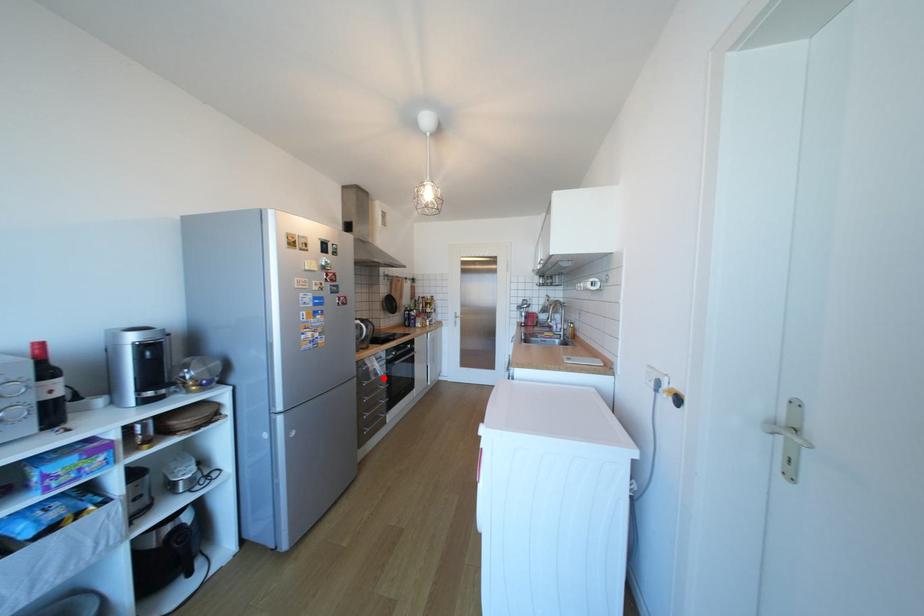
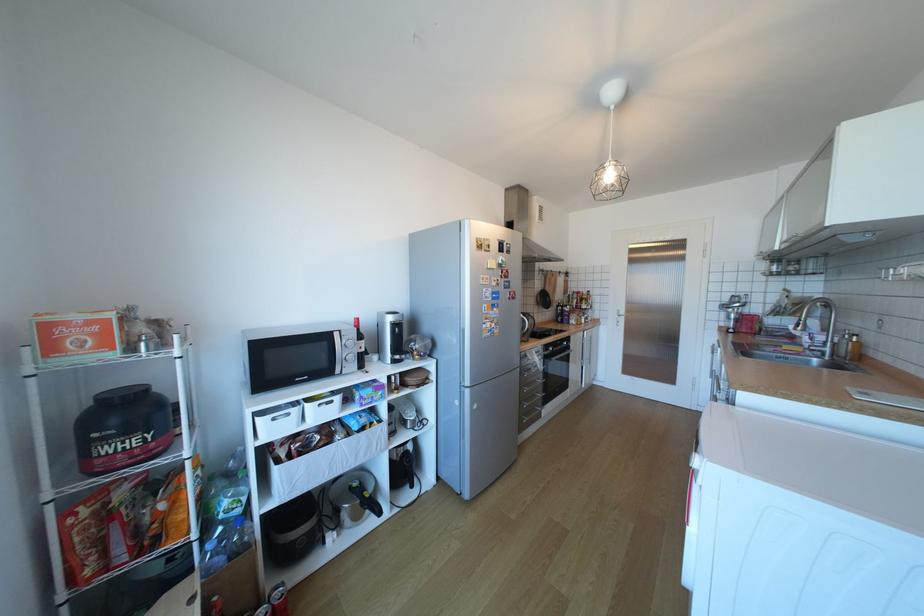
Question: I am providing you with two images of the same scene from different viewpoints. Image1 has a red point marked. In image2, the corresponding 3D location appears at what relative position? Reply with the corresponding letter.

Choices:
 (A) Closer
 (B) Farther

Answer: (B)